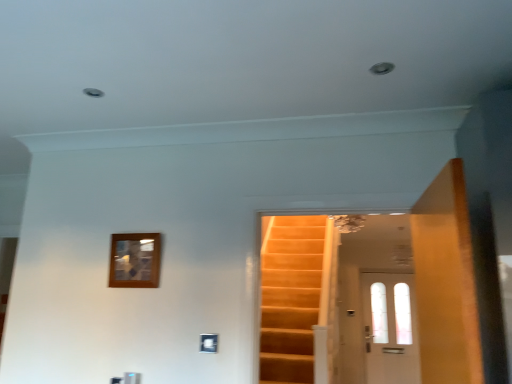
Question: Can you see white glass door at center, which is counted as the first door, starting from the back, touching wooden door at right, which is the second door in bottom-to-top order?

Choices:
 (A) yes
 (B) no

Answer: (B)

Question: From the image's perspective, is white glass door at center, arranged as the second door when viewed from the front, on wooden door at right, positioned as the 1th door in top-to-bottom order?

Choices:
 (A) no
 (B) yes

Answer: (A)

Question: Considering the relative sizes of white glass door at center, marked as the first door in a right-to-left arrangement, and wooden door at right, placed as the 1th door when sorted from front to back, in the image provided, is white glass door at center, marked as the first door in a right-to-left arrangement, wider than wooden door at right, placed as the 1th door when sorted from front to back,?

Choices:
 (A) no
 (B) yes

Answer: (B)

Question: Are white glass door at center, arranged as the second door when viewed from the front, and wooden door at right, which is the second door in bottom-to-top order, far apart?

Choices:
 (A) yes
 (B) no

Answer: (A)

Question: Can we say white glass door at center, arranged as the second door when viewed from the front, lies outside wooden door at right, positioned as the 1th door in left-to-right order?

Choices:
 (A) yes
 (B) no

Answer: (A)

Question: In terms of height, does wooden door at right, which is counted as the second door, starting from the back, look taller or shorter compared to wooden picture frame at upper left?

Choices:
 (A) short
 (B) tall

Answer: (B)

Question: Looking at their shapes, would you say wooden door at right, positioned as the 1th door in left-to-right order, is wider or thinner than wooden picture frame at upper left?

Choices:
 (A) wide
 (B) thin

Answer: (A)

Question: Is point (453, 306) closer or farther from the camera than point (144, 248)?

Choices:
 (A) farther
 (B) closer

Answer: (B)

Question: From a real-world perspective, is wooden door at right, which is the 2th door from right to left, physically located above or below wooden picture frame at upper left?

Choices:
 (A) above
 (B) below

Answer: (B)

Question: Considering the positions of white glass door at center, arranged as the second door when viewed from the front, and wooden door at right, placed as the 1th door when sorted from front to back, in the image, is white glass door at center, arranged as the second door when viewed from the front, wider or thinner than wooden door at right, placed as the 1th door when sorted from front to back,?

Choices:
 (A) thin
 (B) wide

Answer: (B)

Question: In terms of height, does white glass door at center, which is the 1th door from bottom to top, look taller or shorter compared to wooden door at right, positioned as the 1th door in left-to-right order?

Choices:
 (A) tall
 (B) short

Answer: (A)

Question: From a real-world perspective, is white glass door at center, which is the 1th door from bottom to top, above or below wooden door at right, which is the second door in bottom-to-top order?

Choices:
 (A) above
 (B) below

Answer: (B)

Question: From the image's perspective, relative to wooden door at right, which is counted as the second door, starting from the back, is white glass door at center, which ranks as the 2th door in top-to-bottom order, above or below?

Choices:
 (A) above
 (B) below

Answer: (B)

Question: From their relative heights in the image, would you say wooden picture frame at upper left is taller or shorter than white glass door at center, which is counted as the first door, starting from the back?

Choices:
 (A) short
 (B) tall

Answer: (A)

Question: In the image, is wooden picture frame at upper left positioned in front of or behind white glass door at center, arranged as the second door when viewed from the front?

Choices:
 (A) behind
 (B) front

Answer: (B)